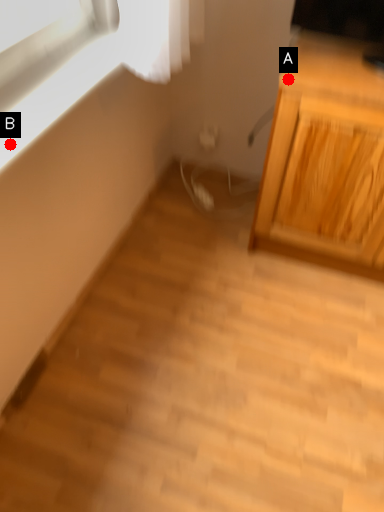
Question: Two points are circled on the image, labeled by A and B beside each circle. Which point appears closest to the camera in this image?

Choices:
 (A) A is closer
 (B) B is closer

Answer: (B)